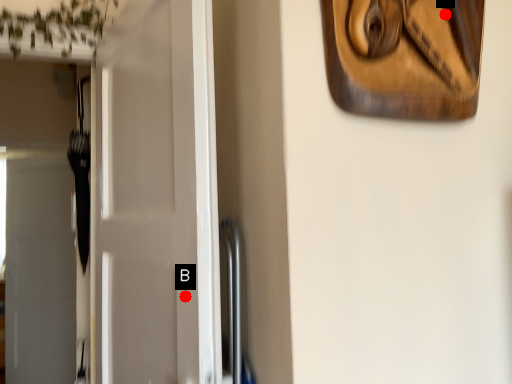
Question: Two points are circled on the image, labeled by A and B beside each circle. Which point is further to the camera?

Choices:
 (A) A is further
 (B) B is further

Answer: (B)